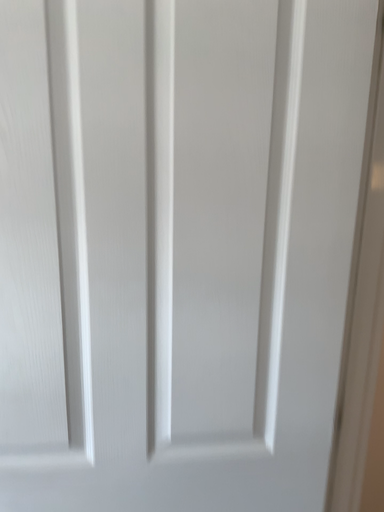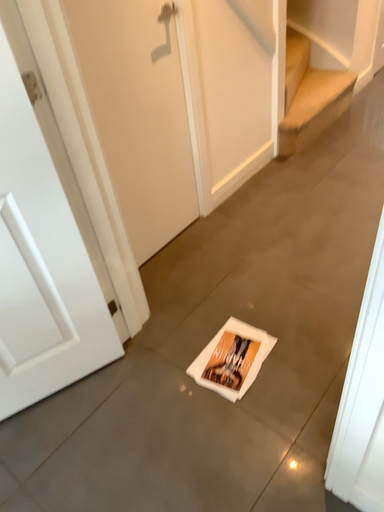
Question: How did the camera likely rotate when shooting the video?

Choices:
 (A) rotated upward
 (B) rotated downward

Answer: (B)